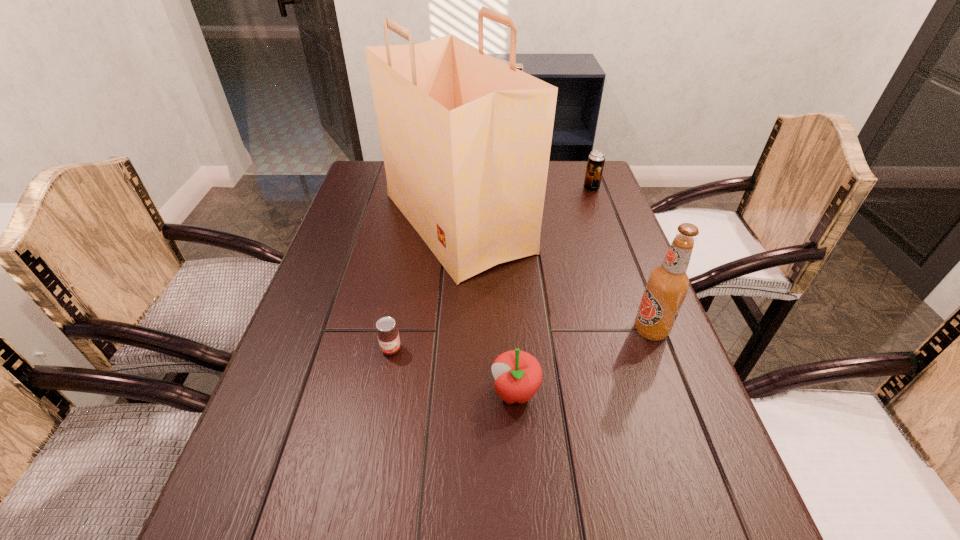
Identify the location of free spot located 0.210m on the left of the nearest object. (384, 393).

Find the location of a particular element. free space located on the label side of the jam is located at coordinates pyautogui.click(x=376, y=427).

The height and width of the screenshot is (540, 960). What are the coordinates of `grocery bag that is at the far edge` in the screenshot? It's located at (466, 139).

Locate an element on the screen. beer can that is at the far edge is located at coordinates (596, 160).

Locate an element on the screen. The width and height of the screenshot is (960, 540). object positioned at the left edge is located at coordinates (466, 139).

At what (x,y) coordinates should I click in order to perform the action: click on beer bottle that is positioned at the right edge. Please return your answer as a coordinate pair (x, y). This screenshot has width=960, height=540. Looking at the image, I should click on (668, 284).

Where is `beer can that is positioned at the right edge`? The height and width of the screenshot is (540, 960). beer can that is positioned at the right edge is located at coordinates (596, 160).

Identify the location of object present at the far left corner. This screenshot has height=540, width=960. (466, 139).

Where is `object present at the far right corner`? The width and height of the screenshot is (960, 540). object present at the far right corner is located at coordinates (596, 160).

In the image, there is a desktop. Identify the location of vacant space at the left edge. The image size is (960, 540). (292, 382).